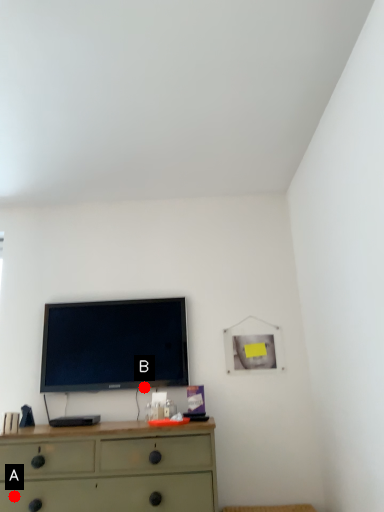
Question: Two points are circled on the image, labeled by A and B beside each circle. Which point appears closest to the camera in this image?

Choices:
 (A) A is closer
 (B) B is closer

Answer: (A)